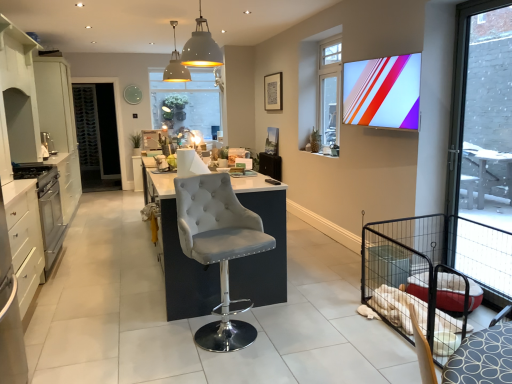
At what (x,y) coordinates should I click in order to perform the action: click on vacant area that lies to the right of silver metallic oven at left, marked as the 1th appliance in a bottom-to-top arrangement. Please return your answer as a coordinate pair (x, y). Looking at the image, I should click on coord(83,264).